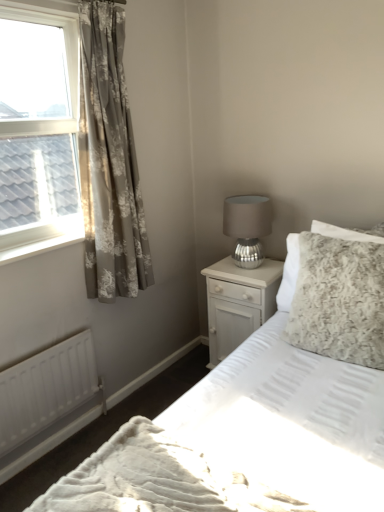
Where is `vacant area on top of white matte radiator at lower left (from a real-world perspective)`? This screenshot has height=512, width=384. vacant area on top of white matte radiator at lower left (from a real-world perspective) is located at coordinates (42, 346).